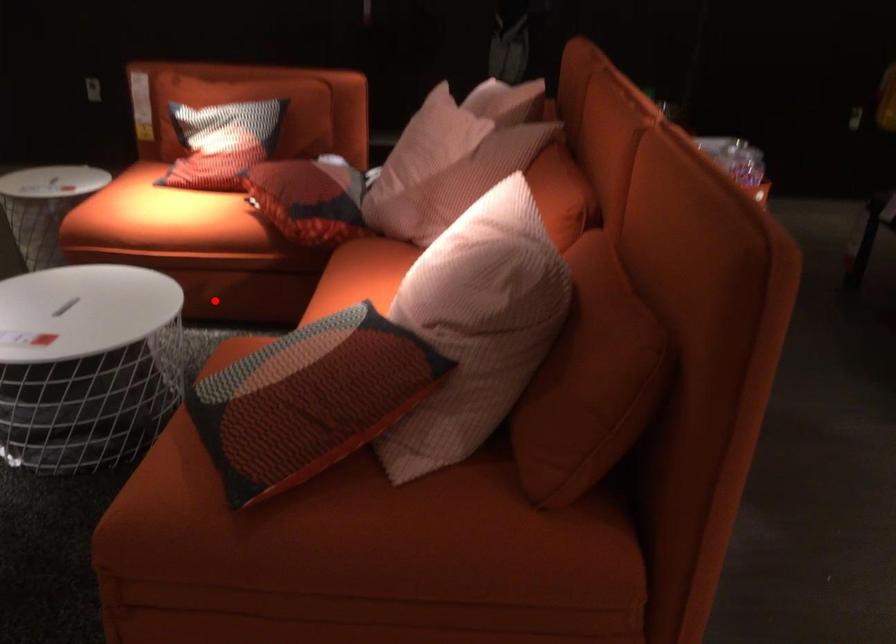
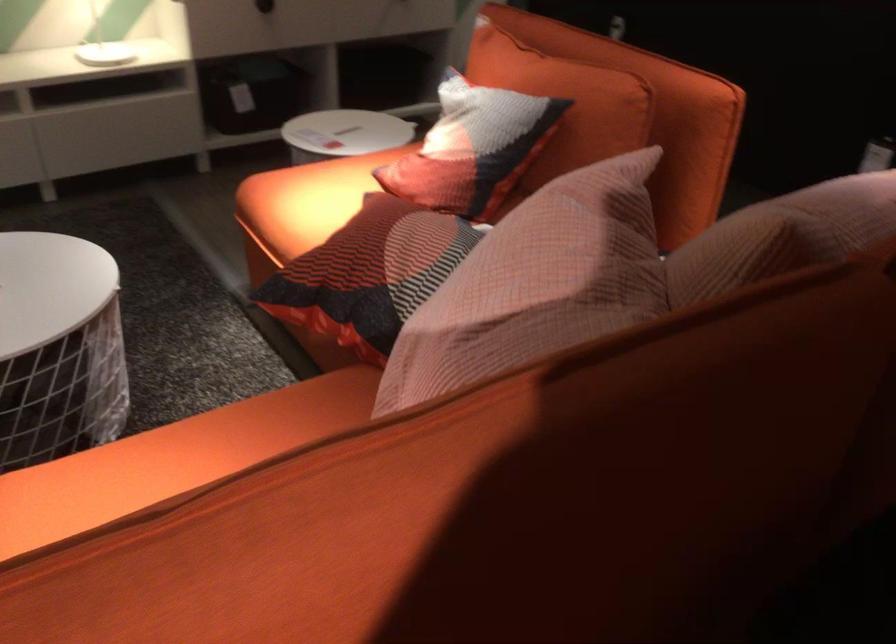
The point at the highlighted location is marked in the first image. Where is the corresponding point in the second image?

(322, 348)